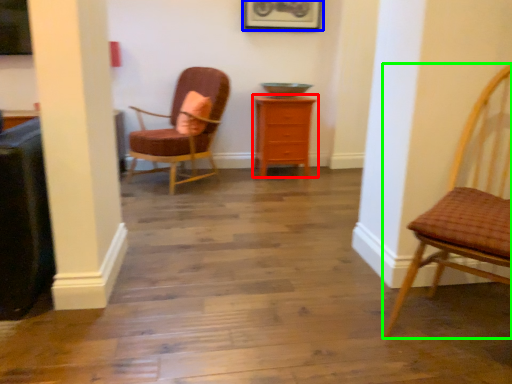
Question: Which is nearer to the chest of drawers (highlighted by a red box)? picture frame (highlighted by a blue box) or chair (highlighted by a green box).

Choices:
 (A) picture frame
 (B) chair

Answer: (A)